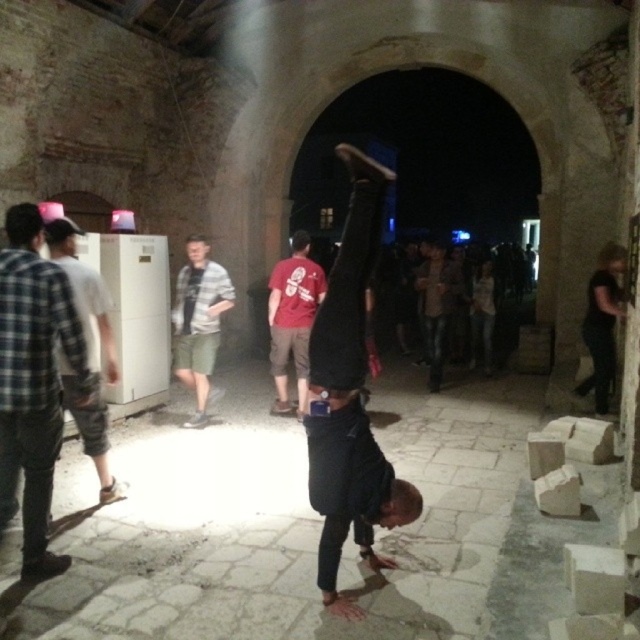
Does black matte pants at center have a smaller size compared to red cotton t-shirt at center?

Indeed, black matte pants at center has a smaller size compared to red cotton t-shirt at center.

Can you confirm if black matte pants at center is wider than red cotton t-shirt at center?

In fact, black matte pants at center might be narrower than red cotton t-shirt at center.

The width and height of the screenshot is (640, 640). I want to click on black matte pants at center, so click(349, 396).

Where is `black matte pants at center`? This screenshot has width=640, height=640. black matte pants at center is located at coordinates [349, 396].

In the scene shown: Can you confirm if plaid fabric shirt at left is taller than red cotton t-shirt at center?

Yes.

Does plaid fabric shirt at left have a smaller size compared to red cotton t-shirt at center?

Yes, plaid fabric shirt at left is smaller than red cotton t-shirt at center.

Identify the location of plaid fabric shirt at left. (33, 381).

I want to click on plaid fabric shirt at left, so click(x=33, y=381).

Is black matte pants at center to the left of plaid shirt at center from the viewer's perspective?

Incorrect, black matte pants at center is not on the left side of plaid shirt at center.

Is point (365, 188) positioned before point (208, 326)?

That is True.

Between point (378, 490) and point (204, 276), which one is positioned behind?

The point (204, 276) is more distant.

What are the coordinates of `black matte pants at center` in the screenshot? It's located at (349, 396).